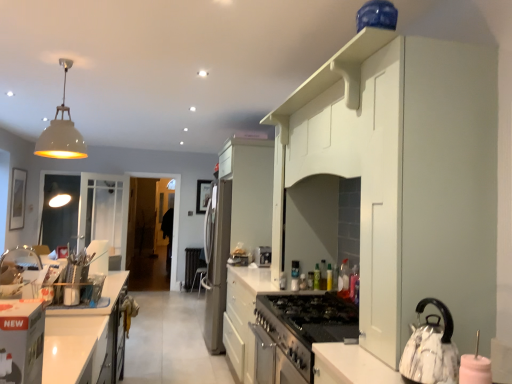
Question: Can you confirm if satin silver toaster at center, the 3th appliance in the right-to-left sequence, is shorter than transparent glass door at center?

Choices:
 (A) yes
 (B) no

Answer: (A)

Question: From the image's perspective, is satin silver toaster at center, which is counted as the second appliance, starting from the left, on top of transparent glass door at center?

Choices:
 (A) no
 (B) yes

Answer: (B)

Question: Is satin silver toaster at center, which is counted as the second appliance, starting from the left, turned away from transparent glass door at center?

Choices:
 (A) no
 (B) yes

Answer: (B)

Question: Is satin silver toaster at center, positioned as the 2th appliance in back-to-front order, to the left of transparent glass door at center from the viewer's perspective?

Choices:
 (A) no
 (B) yes

Answer: (A)

Question: Is satin silver toaster at center, which ranks as the third appliance in top-to-bottom order, smaller than transparent glass door at center?

Choices:
 (A) yes
 (B) no

Answer: (A)

Question: In the image, is satin stainless steel refrigerator at center, which is counted as the 1th appliance, starting from the back, on the left side or the right side of metallic silver stove at center, placed as the 3th appliance when sorted from bottom to top?

Choices:
 (A) left
 (B) right

Answer: (A)

Question: From the image's perspective, is satin stainless steel refrigerator at center, the 1th appliance when ordered from left to right, positioned above or below metallic silver stove at center, which is the 2th appliance in right-to-left order?

Choices:
 (A) below
 (B) above

Answer: (A)

Question: Is satin stainless steel refrigerator at center, arranged as the fourth appliance when viewed from the right, taller or shorter than metallic silver stove at center, which is the 2th appliance from front to back?

Choices:
 (A) short
 (B) tall

Answer: (B)

Question: Is point (225, 236) closer or farther from the camera than point (309, 286)?

Choices:
 (A) farther
 (B) closer

Answer: (A)

Question: From a real-world perspective, is satin silver toaster at center, the 3th appliance in the right-to-left sequence, physically located above or below blue glossy jar at upper center, positioned as the first appliance in front-to-back order?

Choices:
 (A) below
 (B) above

Answer: (A)

Question: Does point (262, 258) appear closer or farther from the camera than point (385, 23)?

Choices:
 (A) closer
 (B) farther

Answer: (B)

Question: Considering the positions of satin silver toaster at center, the third appliance viewed from the front, and blue glossy jar at upper center, which is the fourth appliance in back-to-front order, in the image, is satin silver toaster at center, the third appliance viewed from the front, taller or shorter than blue glossy jar at upper center, which is the fourth appliance in back-to-front order,?

Choices:
 (A) short
 (B) tall

Answer: (B)

Question: Relative to blue glossy jar at upper center, the fourth appliance in the left-to-right sequence, is satin silver toaster at center, the third appliance viewed from the front, in front or behind?

Choices:
 (A) front
 (B) behind

Answer: (B)

Question: In the image, is white matte pendant light at upper left on the left side or the right side of white glossy cabinet at center, the second cabinetry when ordered from front to back?

Choices:
 (A) right
 (B) left

Answer: (B)

Question: Looking at the image, does white matte pendant light at upper left seem bigger or smaller compared to white glossy cabinet at center, arranged as the 1th cabinetry when ordered from the bottom?

Choices:
 (A) small
 (B) big

Answer: (A)